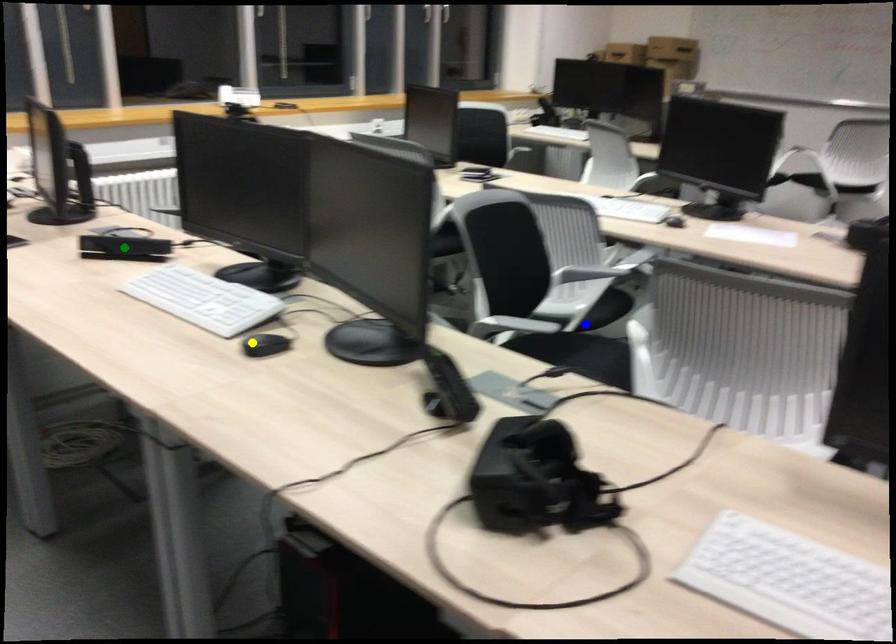
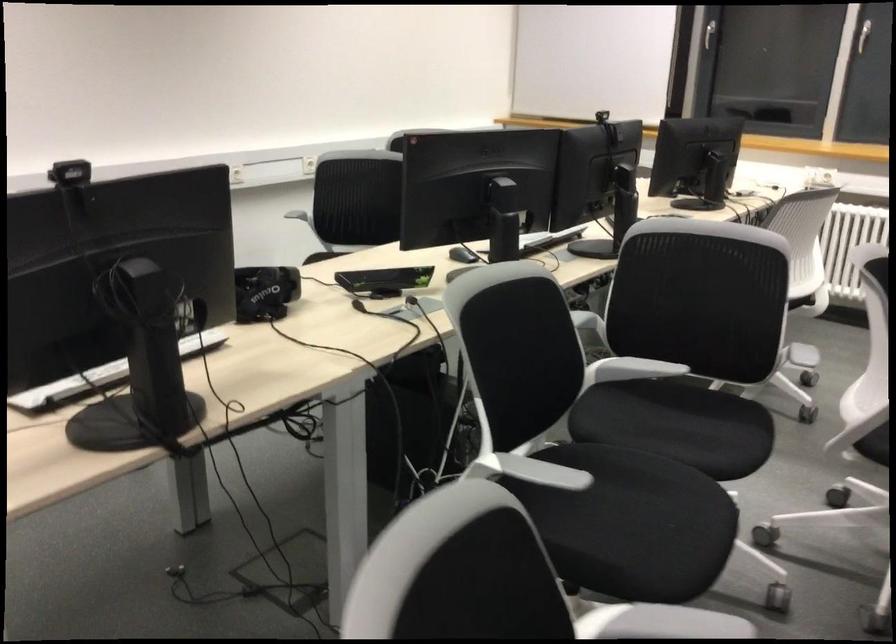
I am providing you with two images of the same scene from different viewpoints. Three points are marked in image1. Which point corresponds to a part or object that is occluded in image2?In image1, three points are marked. Which of them correspond to a part or object that is occluded in image2?Among the three points shown in image1, which one corresponds to a part or object that is no longer visible due to occlusion in image2?

green point